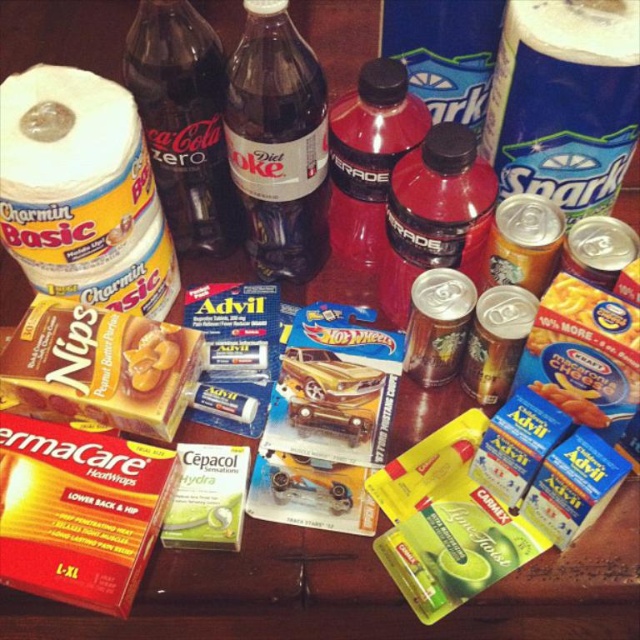
Question: Which object is the closest to the metallic silver soda at center?

Choices:
 (A) dark glass bottle at center
 (B) peanut buttery brownies at center
 (C) pink matte gatorade at center
 (D) clear plastic bottle at upper right

Answer: (C)

Question: Is diet coke bottle at upper center smaller than peanut buttery brownies at center?

Choices:
 (A) no
 (B) yes

Answer: (A)

Question: Which of these objects is positioned closest to the peanut buttery brownies at center?

Choices:
 (A) pink matte gatorade at center
 (B) dark glass bottle at center
 (C) metallic silver soda at center
 (D) diet coke bottle at upper center

Answer: (B)

Question: Is the position of clear plastic bottle at upper right more distant than that of diet coke bottle at upper center?

Choices:
 (A) no
 (B) yes

Answer: (B)

Question: Which object is the closest to the peanut buttery brownies at center?

Choices:
 (A) diet coke bottle at upper center
 (B) clear plastic bottle at upper right

Answer: (A)

Question: Is peanut buttery brownies at center to the right of metallic silver soda at center from the viewer's perspective?

Choices:
 (A) yes
 (B) no

Answer: (B)